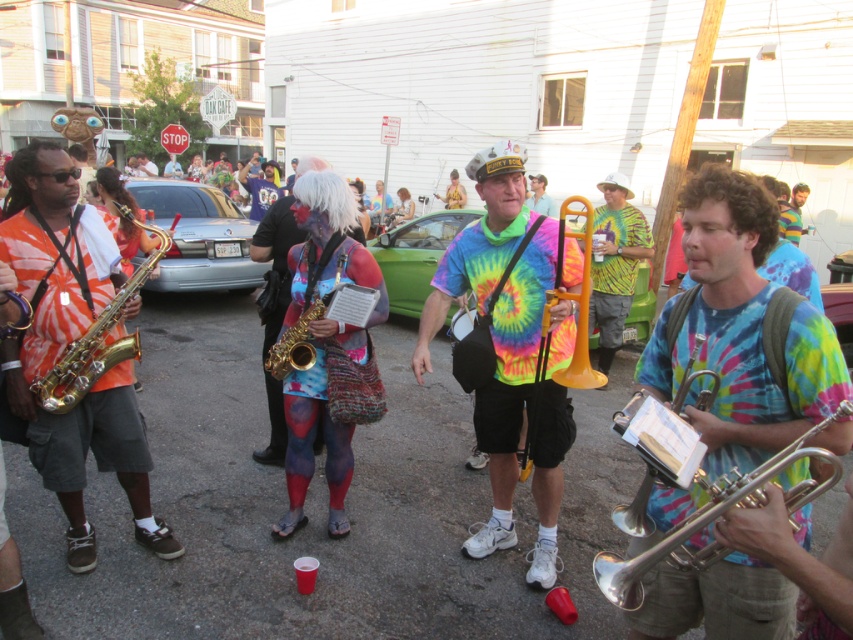
You are a photographer trying to capture the street scene. You notice two points in the image at coordinates point (306, 224) and point (299, 237). Which point will appear larger in your photo?

Point (306, 224) is closer to the camera than point (299, 237), so it will appear larger in the photo.

In the scene shown: You are a spectator standing on the sidewalk watching the musicians. You notice the matte yellow tuba at center and the gold brass trumpet at left. Which instrument is closer to your left side?

The gold brass trumpet at left is closer to your left side because it is positioned to the left of the matte yellow tuba at center.